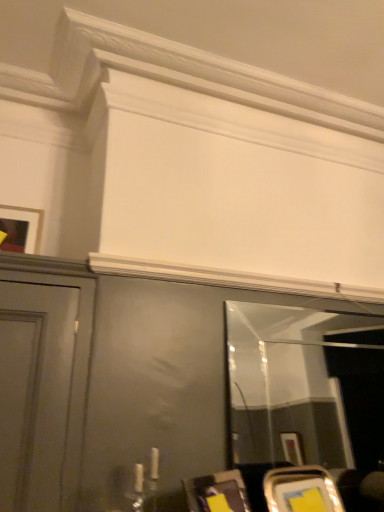
Question: Is matte black picture frame at upper left closer to the viewer compared to clear glass mirror at center?

Choices:
 (A) yes
 (B) no

Answer: (B)

Question: From the image's perspective, does matte black picture frame at upper left appear higher than clear glass mirror at center?

Choices:
 (A) yes
 (B) no

Answer: (A)

Question: Does matte black picture frame at upper left come behind clear glass mirror at center?

Choices:
 (A) yes
 (B) no

Answer: (A)

Question: From the image's perspective, is matte black picture frame at upper left under clear glass mirror at center?

Choices:
 (A) no
 (B) yes

Answer: (A)

Question: Considering the relative positions of matte black picture frame at upper left and clear glass mirror at center in the image provided, is matte black picture frame at upper left to the left of clear glass mirror at center from the viewer's perspective?

Choices:
 (A) yes
 (B) no

Answer: (A)

Question: Is matte black picture frame at upper left not close to clear glass mirror at center?

Choices:
 (A) yes
 (B) no

Answer: (A)

Question: Is clear glass mirror at center closer to camera compared to matte black picture frame at upper left?

Choices:
 (A) no
 (B) yes

Answer: (B)

Question: Considering the relative sizes of clear glass mirror at center and matte black picture frame at upper left in the image provided, is clear glass mirror at center wider than matte black picture frame at upper left?

Choices:
 (A) yes
 (B) no

Answer: (B)

Question: Considering the relative sizes of clear glass mirror at center and matte black picture frame at upper left in the image provided, is clear glass mirror at center smaller than matte black picture frame at upper left?

Choices:
 (A) no
 (B) yes

Answer: (A)

Question: Is clear glass mirror at center next to matte black picture frame at upper left?

Choices:
 (A) yes
 (B) no

Answer: (B)

Question: From a real-world perspective, is clear glass mirror at center on top of matte black picture frame at upper left?

Choices:
 (A) yes
 (B) no

Answer: (B)

Question: Does clear glass mirror at center contain matte black picture frame at upper left?

Choices:
 (A) no
 (B) yes

Answer: (A)

Question: In terms of width, does clear glass mirror at center look wider or thinner when compared to matte black picture frame at upper left?

Choices:
 (A) wide
 (B) thin

Answer: (B)